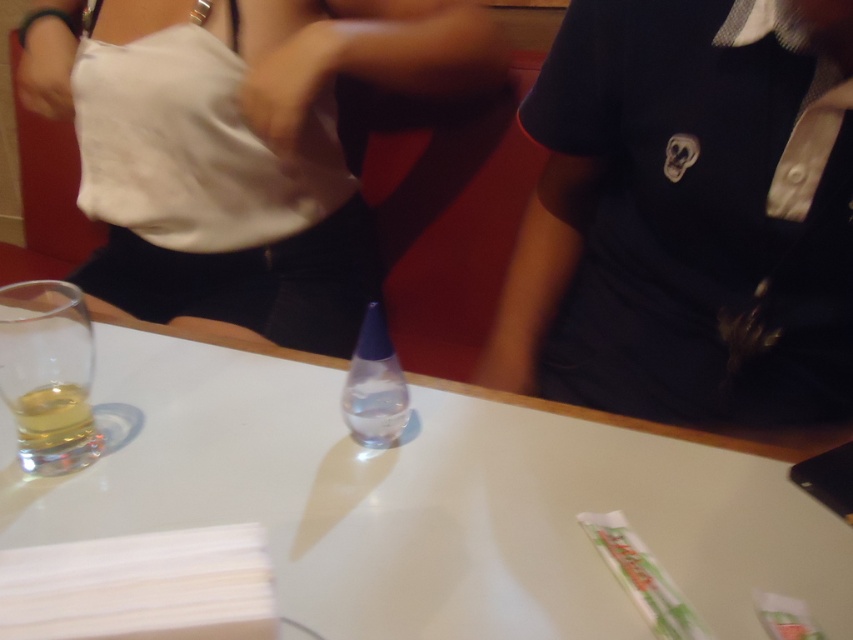
You are a waiter in a restaurant and need to place a new menu on the table. The menu is 12 inches wide. Can you place it on the white glossy table at center without overlapping the transparent glass at left?

The white glossy table at center is positioned on the right side of transparent glass at left, so there should be enough space to place the 12 inch menu on the white glossy table at center without overlapping the glass as long as it is placed to the right of the glass.